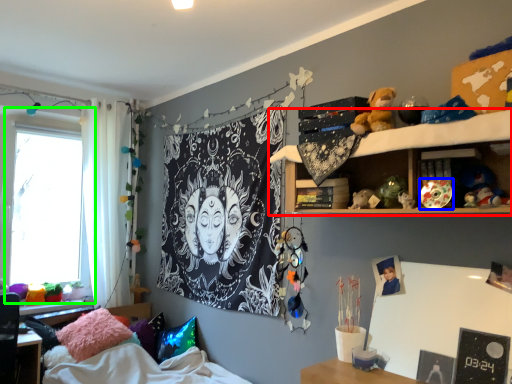
Question: Which object is positioned farthest from shelf (highlighted by a red box)? Select from toy (highlighted by a blue box) and window (highlighted by a green box).

Choices:
 (A) toy
 (B) window

Answer: (B)